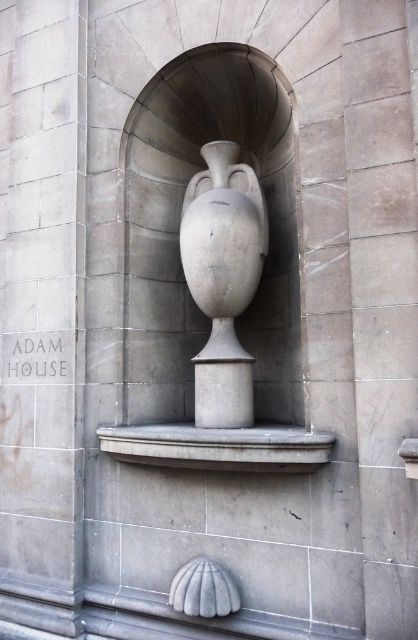
Question: Considering the relative positions of gray stone urn at center and gray stone ledge at center in the image provided, where is gray stone urn at center located with respect to gray stone ledge at center?

Choices:
 (A) below
 (B) above

Answer: (B)

Question: Based on their relative distances, which object is nearer to the gray stone ledge at center?

Choices:
 (A) gray stone urn at center
 (B) white stone vase at center

Answer: (B)

Question: Is gray stone urn at center behind gray stone ledge at center?

Choices:
 (A) yes
 (B) no

Answer: (A)

Question: Which point is closer to the camera taking this photo?

Choices:
 (A) (265, 132)
 (B) (206, 195)
 (C) (173, 458)

Answer: (C)

Question: Is gray stone urn at center behind white stone vase at center?

Choices:
 (A) no
 (B) yes

Answer: (B)

Question: Which object is the closest to the gray stone ledge at center?

Choices:
 (A) gray stone urn at center
 (B) white stone vase at center

Answer: (B)